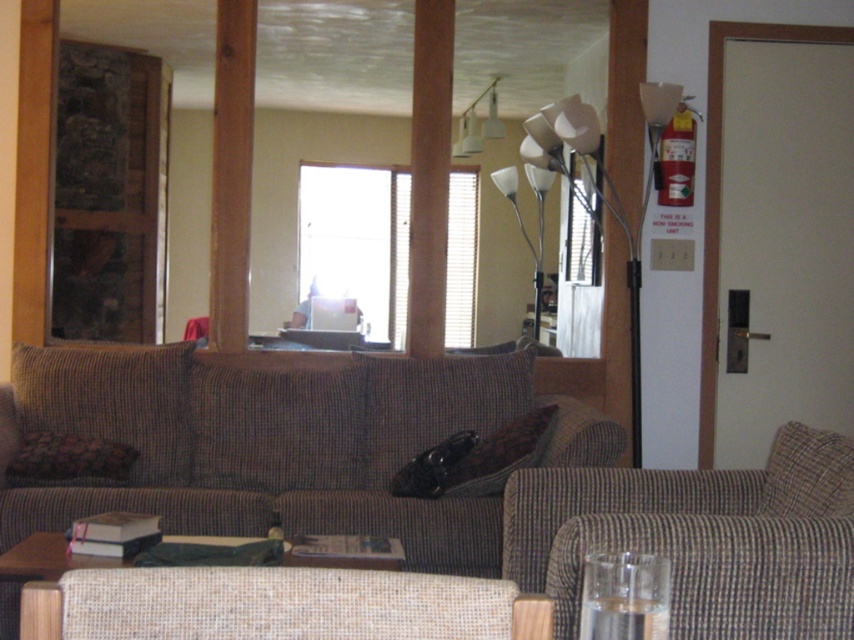
Between point (664, 113) and point (37, 579), which one is positioned behind?

The point (664, 113) is behind.

Does white glossy floor lamp at upper center have a larger size compared to beige woven table at lower center?

Yes, white glossy floor lamp at upper center is bigger than beige woven table at lower center.

I want to click on white glossy floor lamp at upper center, so click(607, 188).

Identify the location of white glossy floor lamp at upper center. The height and width of the screenshot is (640, 854). (607, 188).

Is brown textured couch at center smaller than brown textured pillow at center?

No, brown textured couch at center is not smaller than brown textured pillow at center.

Between point (475, 369) and point (510, 422), which one is positioned in front?

Point (510, 422)

You are a GUI agent. You are given a task and a screenshot of the screen. Output one action in this format:
    pyautogui.click(x=<x>, y=<y>)
    Task: Click on the brown textured couch at center
    This screenshot has width=854, height=640.
    Given the screenshot: What is the action you would take?
    pyautogui.click(x=285, y=442)

Describe the element at coordinates (285, 442) in the screenshot. Image resolution: width=854 pixels, height=640 pixels. I see `brown textured couch at center` at that location.

Locate an element on the screen. This screenshot has height=640, width=854. brown textured couch at center is located at coordinates (285, 442).

Find the location of a particular element. brown textured couch at center is located at coordinates (285, 442).

Where is `brown textured couch at center`? The image size is (854, 640). brown textured couch at center is located at coordinates (285, 442).